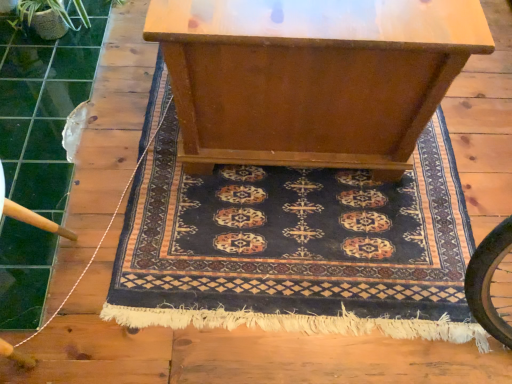
Where is `free space above dark blue woven rug at center (from a real-world perspective)`? The width and height of the screenshot is (512, 384). free space above dark blue woven rug at center (from a real-world perspective) is located at coordinates (303, 222).